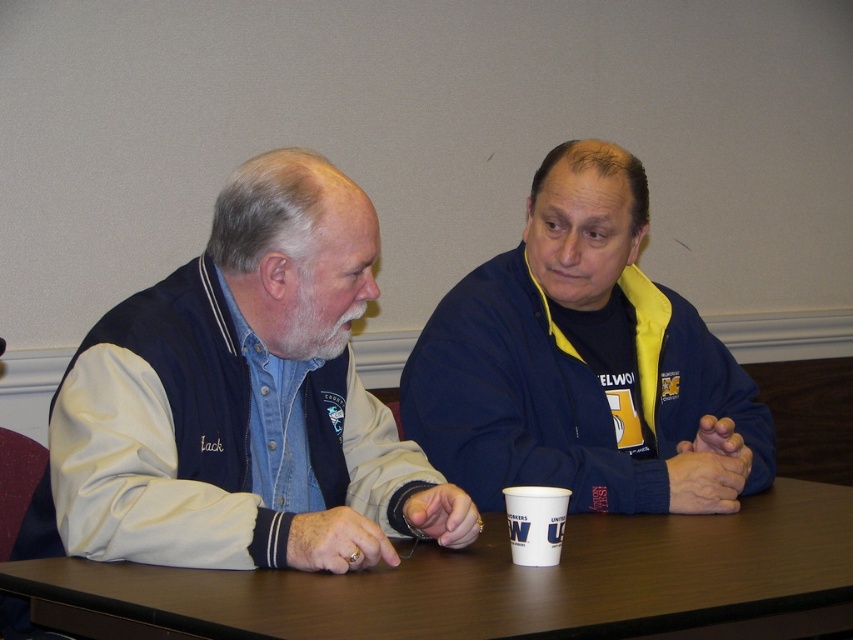
You are standing in the room and want to hand a document to the person wearing the navy blue jacket at center. Which direction should you move to approach them from the denim jacket at left?

The navy blue jacket at center is to the right of the denim jacket at left, so you should move to the right to approach the person wearing the navy blue jacket at center from the denim jacket at left.

You are trying to locate a specific point marked as point (245,400) in the image. Based on the scene description, which object is this point located on?

The point (245,400) is located on the denim jacket at left.